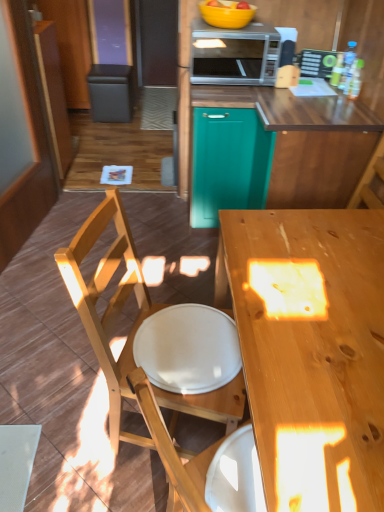
Identify the location of vacant point above white matte plate at center (from a real-world perspective). Image resolution: width=384 pixels, height=512 pixels. (191, 346).